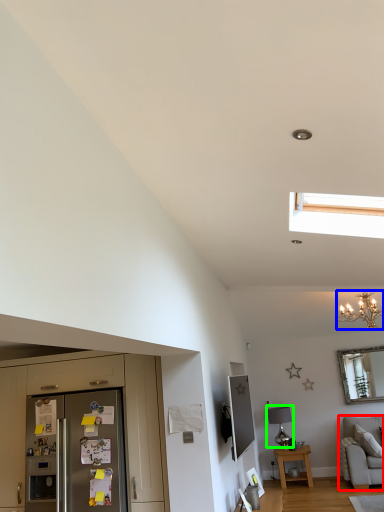
Question: Which object is positioned farthest from studio couch (highlighted by a red box)? Select from light fixture (highlighted by a blue box) and lamp (highlighted by a green box).

Choices:
 (A) light fixture
 (B) lamp

Answer: (A)